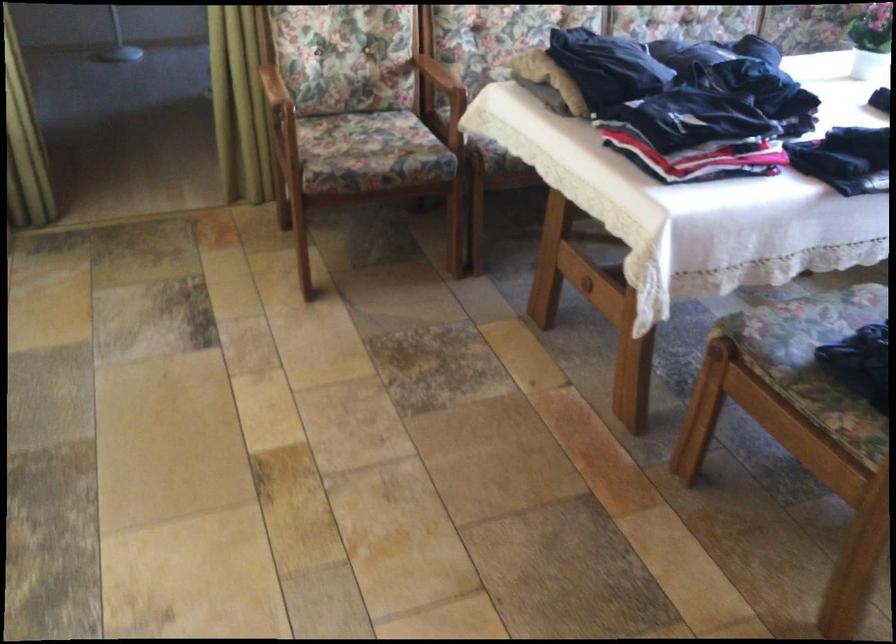
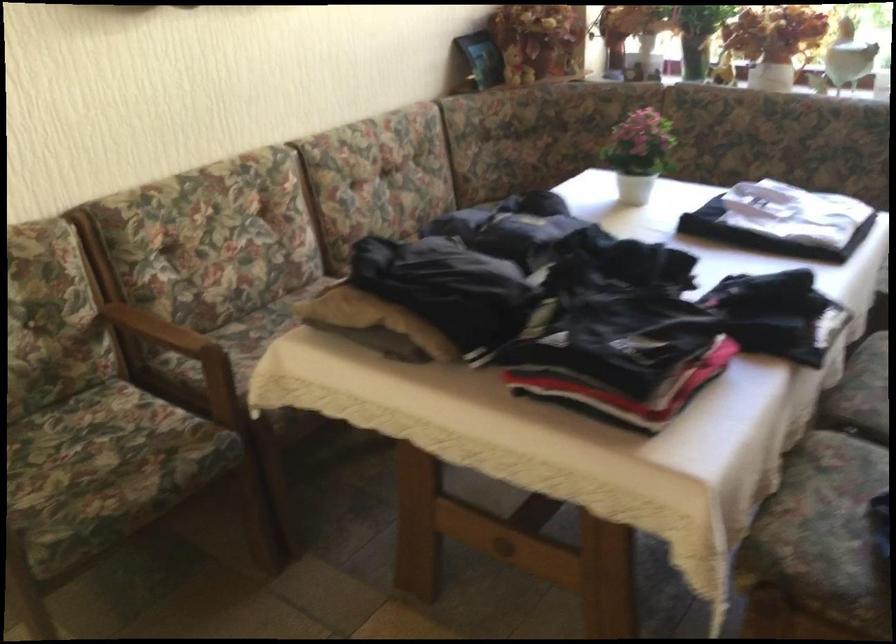
Question: The first image is from the beginning of the video and the second image is from the end. How did the camera likely rotate when shooting the video?

Choices:
 (A) Left
 (B) Right
 (C) Up
 (D) Down

Answer: (B)